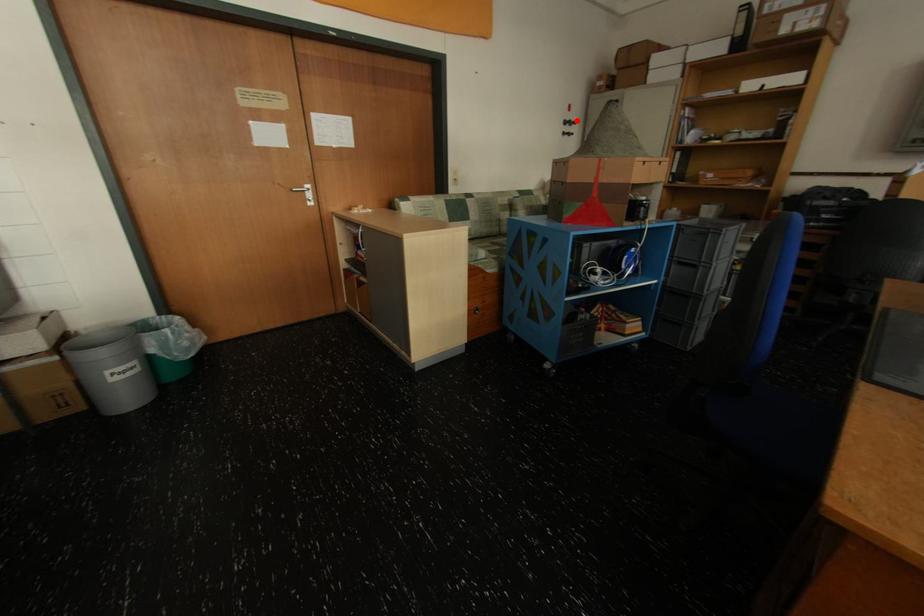
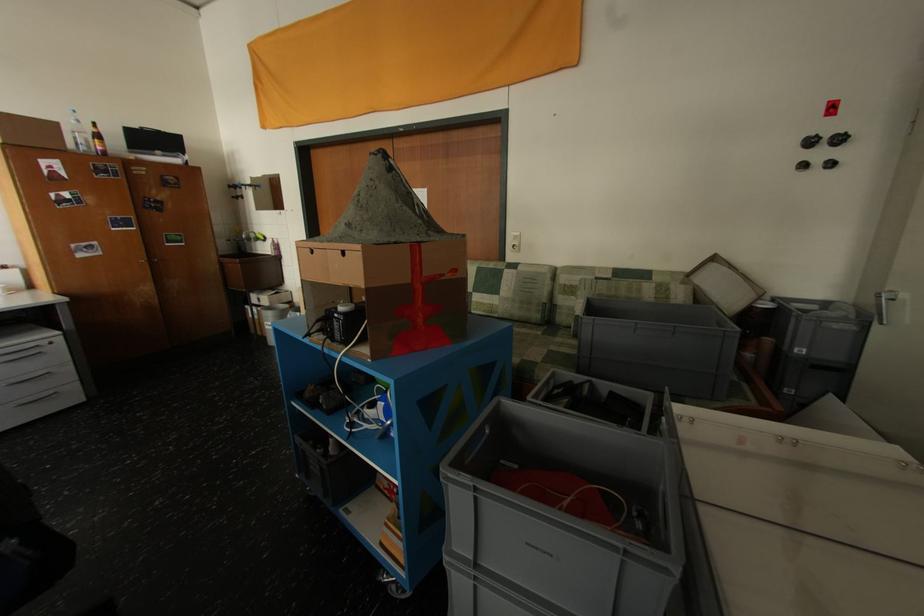
Question: A red point is marked in image1. In image2, is the corresponding 3D point closer to the camera or farther? Reply with the corresponding letter.

Choices:
 (A) The corresponding 3D point is closer.
 (B) The corresponding 3D point is farther.

Answer: (B)